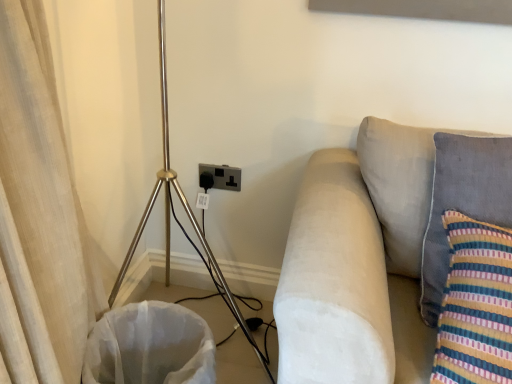
Describe the element at coordinates (39, 215) in the screenshot. I see `beige fabric curtain at left` at that location.

Image resolution: width=512 pixels, height=384 pixels. Describe the element at coordinates (223, 176) in the screenshot. I see `black plastic electric outlet at lower center` at that location.

Where is `white fabric laundry basket at lower left`? white fabric laundry basket at lower left is located at coordinates (150, 346).

Is black plastic electric outlet at lower center far away from polished brass tripod at left?

black plastic electric outlet at lower center is actually quite close to polished brass tripod at left.

Which is in front, point (212, 169) or point (243, 330)?

Positioned in front is point (212, 169).

Is black plastic electric outlet at lower center positioned with its back to polished brass tripod at left?

No, black plastic electric outlet at lower center is not facing the opposite direction of polished brass tripod at left.

Is black plastic electric outlet at lower center wider than polished brass tripod at left?

Incorrect, the width of black plastic electric outlet at lower center does not surpass that of polished brass tripod at left.

Would you say white fabric laundry basket at lower left contains beige fabric curtain at left?

No, beige fabric curtain at left is not inside white fabric laundry basket at lower left.

Considering the positions of objects white fabric laundry basket at lower left and beige fabric curtain at left in the image provided, who is more to the right, white fabric laundry basket at lower left or beige fabric curtain at left?

white fabric laundry basket at lower left is more to the right.

From a real-world perspective, is white fabric laundry basket at lower left on top of beige fabric curtain at left?

Incorrect, from a real-world perspective, white fabric laundry basket at lower left is lower than beige fabric curtain at left.

Considering the relative positions of white fabric laundry basket at lower left and beige fabric curtain at left in the image provided, is white fabric laundry basket at lower left behind beige fabric curtain at left?

Yes, white fabric laundry basket at lower left is further from the camera.

Is white fabric laundry basket at lower left situated inside suede beige couch at right or outside?

white fabric laundry basket at lower left is spatially situated outside suede beige couch at right.

Does point (154, 364) come closer to viewer compared to point (383, 245)?

No, it is behind (383, 245).

Based on their positions, is white fabric laundry basket at lower left located to the left or right of suede beige couch at right?

white fabric laundry basket at lower left is positioned on suede beige couch at right's left side.

In terms of size, does white fabric laundry basket at lower left appear bigger or smaller than suede beige couch at right?

Considering their sizes, white fabric laundry basket at lower left takes up less space than suede beige couch at right.

Between point (352, 207) and point (468, 166), which one is positioned in front?

Positioned in front is point (468, 166).

In terms of width, does suede beige couch at right look wider or thinner when compared to velvety gray pillow at right?

suede beige couch at right is wider than velvety gray pillow at right.

Based on the photo, is suede beige couch at right completely or partially outside of velvety gray pillow at right?

Yes, suede beige couch at right is outside of velvety gray pillow at right.

Can you confirm if suede beige couch at right is taller than velvety gray pillow at right?

Yes, suede beige couch at right is taller than velvety gray pillow at right.

Identify the location of laundry basket directly beneath the black plastic electric outlet at lower center (from a real-world perspective). (150, 346).

Is black plastic electric outlet at lower center facing towards white fabric laundry basket at lower left?

No, black plastic electric outlet at lower center is not turned towards white fabric laundry basket at lower left.

Between black plastic electric outlet at lower center and white fabric laundry basket at lower left, which one appears on the right side from the viewer's perspective?

Positioned to the right is black plastic electric outlet at lower center.

Is black plastic electric outlet at lower center completely or partially outside of white fabric laundry basket at lower left?

Yes, black plastic electric outlet at lower center is outside of white fabric laundry basket at lower left.

Choose the correct answer: Is black plastic electric outlet at lower center inside beige fabric curtain at left or outside it?

black plastic electric outlet at lower center is spatially situated outside beige fabric curtain at left.

From the picture: Between black plastic electric outlet at lower center and beige fabric curtain at left, which one has smaller width?

black plastic electric outlet at lower center is thinner.

Is black plastic electric outlet at lower center looking in the opposite direction of beige fabric curtain at left?

black plastic electric outlet at lower center does not have its back to beige fabric curtain at left.

Looking at this image, which is closer to the camera, (x=234, y=182) or (x=76, y=253)?

The point (x=76, y=253) is in front.

Does point (320, 195) appear closer or farther from the camera than point (31, 173)?

Point (320, 195) is positioned farther from the camera compared to point (31, 173).

Is suede beige couch at right facing towards beige fabric curtain at left?

No, suede beige couch at right is not facing towards beige fabric curtain at left.

Which of these two, suede beige couch at right or beige fabric curtain at left, stands taller?

beige fabric curtain at left.

The width and height of the screenshot is (512, 384). What are the coordinates of `tripod below the black plastic electric outlet at lower center (from the image's perspective)` in the screenshot? It's located at (184, 209).

Identify the location of curtain above the white fabric laundry basket at lower left (from a real-world perspective). This screenshot has height=384, width=512. (39, 215).

From the image, which object appears to be nearer to white fabric laundry basket at lower left, suede beige couch at right or black plastic electric outlet at lower center?

suede beige couch at right is closer to white fabric laundry basket at lower left.

Estimate the real-world distances between objects in this image. Which object is closer to beige fabric curtain at left, white fabric laundry basket at lower left or suede beige couch at right?

white fabric laundry basket at lower left.

When comparing their distances from beige fabric curtain at left, does white fabric laundry basket at lower left or velvety gray pillow at right seem further?

velvety gray pillow at right lies further to beige fabric curtain at left than the other object.

Looking at the image, which one is located further to white fabric laundry basket at lower left, velvety gray pillow at right or polished brass tripod at left?

velvety gray pillow at right is positioned further to the anchor white fabric laundry basket at lower left.

When comparing their distances from polished brass tripod at left, does black plastic electric outlet at lower center or beige fabric curtain at left seem closer?

black plastic electric outlet at lower center.

Estimate the real-world distances between objects in this image. Which object is closer to white fabric laundry basket at lower left, black plastic electric outlet at lower center or velvety gray pillow at right?

black plastic electric outlet at lower center.

Which object lies further to the anchor point polished brass tripod at left, black plastic electric outlet at lower center or white fabric laundry basket at lower left?

white fabric laundry basket at lower left lies further to polished brass tripod at left than the other object.

Which object lies further to the anchor point white fabric laundry basket at lower left, beige fabric curtain at left or black plastic electric outlet at lower center?

Based on the image, black plastic electric outlet at lower center appears to be further to white fabric laundry basket at lower left.

Identify the location of pillow between polished brass tripod at left and black plastic electric outlet at lower center along the z-axis. (462, 203).

Identify the location of tripod located between beige fabric curtain at left and white fabric laundry basket at lower left in the depth direction. The image size is (512, 384). (184, 209).

Where is `pillow between suede beige couch at right and black plastic electric outlet at lower center from front to back`? The image size is (512, 384). pillow between suede beige couch at right and black plastic electric outlet at lower center from front to back is located at coordinates (462, 203).

You are a GUI agent. You are given a task and a screenshot of the screen. Output one action in this format:
    pyautogui.click(x=<x>, y=<y>)
    Task: Click on the tripod between white fabric laundry basket at lower left and suede beige couch at right from left to right
    
    Given the screenshot: What is the action you would take?
    [x=184, y=209]